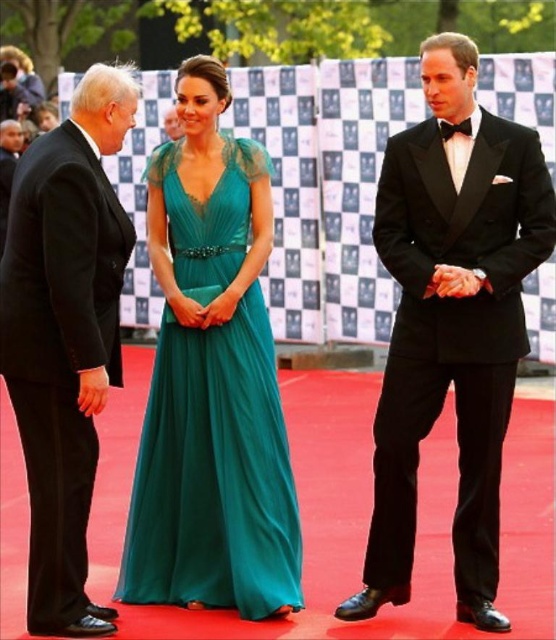
You are a photographer at the event and want to focus on the black satin tuxedo at center and the emerald green chiffon dress at center. Which one is closer to your camera lens?

The black satin tuxedo at center is closer to the viewer than the emerald green chiffon dress at center, so the black satin tuxedo at center will be closer to your camera lens.

You are a photographer at the event and need to position a spotlight on the emerald green chiffon dress at center and the black satin suit at left. Since the spotlight can only illuminate one person at a time, which one should you choose to light first if you want to follow the natural left to right viewing direction?

The emerald green chiffon dress at center should be lit first because it is positioned to the right of the black satin suit at left, aligning with the natural left to right viewing direction.

You are a photographer at this formal event. You need to ensure that both the black satin tuxedo at center and the emerald green chiffon dress at center are clearly visible in your photo. Given their sizes, which one might require more careful framing to avoid being overshadowed?

The black satin tuxedo at center is smaller than the emerald green chiffon dress at center, so the tuxedo may need more careful framing to ensure it isn t overshadowed by the larger dress.